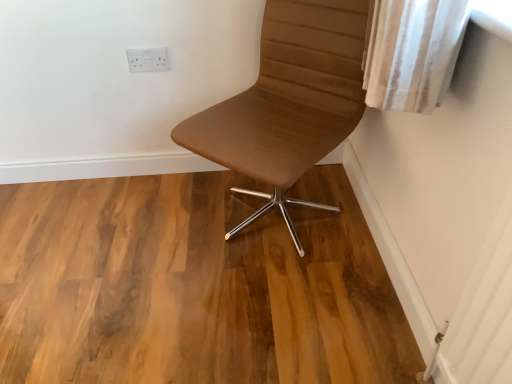
Measure the distance between point (234, 259) and camera.

A distance of 1.50 meters exists between point (234, 259) and camera.

What is the approximate height of white plastic outlet at upper center?

3.62 inches.

Measure the distance between white plastic outlet at upper center and camera.

They are 1.61 meters apart.

Describe the element at coordinates (289, 101) in the screenshot. Image resolution: width=512 pixels, height=384 pixels. I see `brown leather chair at center` at that location.

Measure the distance between brown leather chair at center and camera.

A distance of 1.14 meters exists between brown leather chair at center and camera.

You are a GUI agent. You are given a task and a screenshot of the screen. Output one action in this format:
    pyautogui.click(x=<x>, y=<y>)
    Task: Click on the natural wood floor at center
    The height and width of the screenshot is (384, 512).
    Given the screenshot: What is the action you would take?
    pyautogui.click(x=194, y=285)

Is natural wood floor at center with white plastic outlet at upper center?

There is a gap between natural wood floor at center and white plastic outlet at upper center.

Is natural wood floor at center shorter than white plastic outlet at upper center?

Correct, natural wood floor at center is not as tall as white plastic outlet at upper center.

Which is in front, point (62, 326) or point (140, 55)?

The point (62, 326) is more forward.

From the picture: Can you confirm if white plastic outlet at upper center is smaller than brown leather chair at center?

Yes, white plastic outlet at upper center is smaller than brown leather chair at center.

Is white plastic outlet at upper center far away from brown leather chair at center?

No, white plastic outlet at upper center is in close proximity to brown leather chair at center.

How many degrees apart are the facing directions of white plastic outlet at upper center and brown leather chair at center?

39.9 degrees.

Consider the image. Which is behind, natural wood floor at center or brown leather chair at center?

Positioned behind is natural wood floor at center.

In terms of width, does natural wood floor at center look wider or thinner when compared to brown leather chair at center?

Considering their sizes, natural wood floor at center looks broader than brown leather chair at center.

Which of these two, natural wood floor at center or brown leather chair at center, stands shorter?

natural wood floor at center is shorter.

From the image's perspective, between natural wood floor at center and brown leather chair at center, which one is located above?

From the image's view, brown leather chair at center is above.

The height and width of the screenshot is (384, 512). I want to click on chair lying on the right of natural wood floor at center, so click(289, 101).

Considering the positions of points (274, 68) and (126, 360), is point (274, 68) closer to camera compared to point (126, 360)?

No, it is behind (126, 360).

Is brown leather chair at center shorter than natural wood floor at center?

Incorrect, the height of brown leather chair at center does not fall short of that of natural wood floor at center.

Does brown leather chair at center turn towards natural wood floor at center?

Yes, brown leather chair at center is turned towards natural wood floor at center.

Is brown leather chair at center inside or outside of white plastic outlet at upper center?

brown leather chair at center exists outside the volume of white plastic outlet at upper center.

Does brown leather chair at center lie in front of white plastic outlet at upper center?

Yes.

From the image's perspective, is brown leather chair at center located above or below white plastic outlet at upper center?

Clearly, from the image's perspective, brown leather chair at center is below white plastic outlet at upper center.

Is point (287, 1) closer or farther from the camera than point (153, 48)?

Point (287, 1) appears to be closer to the viewer than point (153, 48).

From a real-world perspective, is white plastic outlet at upper center beneath natural wood floor at center?

No.

Which is further, [157,60] or [210,345]?

The point [157,60] is behind.

I want to click on hardwood on the right of white plastic outlet at upper center, so click(194, 285).

At what (x,y) coordinates should I click in order to perform the action: click on hardwood on the right of white plastic outlet at upper center. Please return your answer as a coordinate pair (x, y). The width and height of the screenshot is (512, 384). Looking at the image, I should click on (194, 285).

You are a GUI agent. You are given a task and a screenshot of the screen. Output one action in this format:
    pyautogui.click(x=<x>, y=<y>)
    Task: Click on the electric outlet above the brown leather chair at center (from the image's perspective)
    The width and height of the screenshot is (512, 384).
    Given the screenshot: What is the action you would take?
    pyautogui.click(x=148, y=60)

Estimate the real-world distances between objects in this image. Which object is closer to brown leather chair at center, natural wood floor at center or white plastic outlet at upper center?

Based on the image, natural wood floor at center appears to be nearer to brown leather chair at center.

Looking at the image, which one is located further to white plastic outlet at upper center, natural wood floor at center or brown leather chair at center?

natural wood floor at center.

In the scene shown: When comparing their distances from brown leather chair at center, does white plastic outlet at upper center or natural wood floor at center seem closer?

The object closer to brown leather chair at center is natural wood floor at center.

When comparing their distances from natural wood floor at center, does brown leather chair at center or white plastic outlet at upper center seem further?

Based on the image, white plastic outlet at upper center appears to be further to natural wood floor at center.

Estimate the real-world distances between objects in this image. Which object is closer to white plastic outlet at upper center, brown leather chair at center or natural wood floor at center?

brown leather chair at center is positioned closer to the anchor white plastic outlet at upper center.

Based on their spatial positions, is white plastic outlet at upper center or brown leather chair at center further from natural wood floor at center?

white plastic outlet at upper center.

Where is `hardwood between brown leather chair at center and white plastic outlet at upper center from front to back`? The width and height of the screenshot is (512, 384). hardwood between brown leather chair at center and white plastic outlet at upper center from front to back is located at coordinates (194, 285).